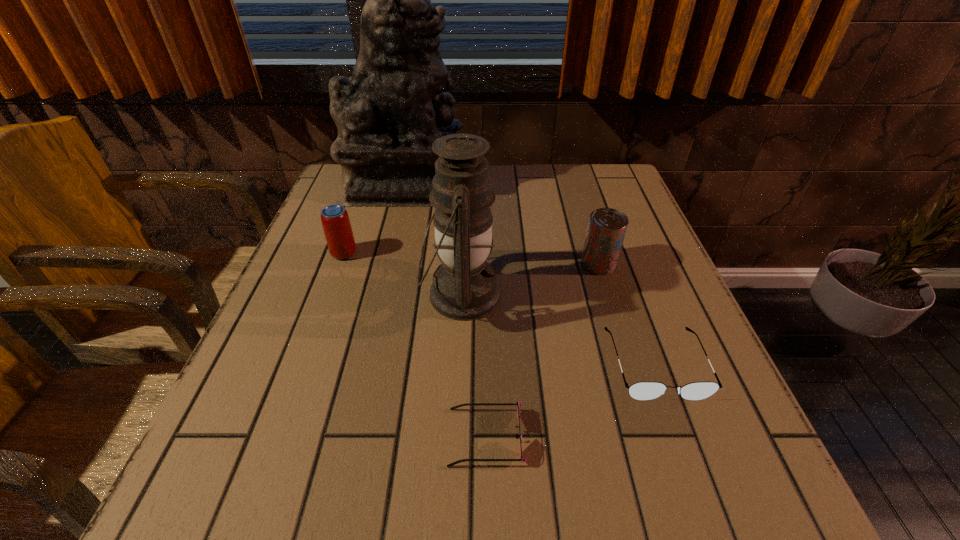
Locate an element on the screen. The width and height of the screenshot is (960, 540). vacant space situated 0.290m on the left of the right beer can is located at coordinates (452, 264).

The height and width of the screenshot is (540, 960). Identify the location of free space located 0.120m on the front of the left beer can. (327, 299).

Find the location of a particular element. vacant position located 0.130m on the lenses of the second shortest object is located at coordinates (697, 481).

This screenshot has height=540, width=960. In order to click on free region located on the bridge of the shortest object in this screenshot , I will do pos(236,437).

Image resolution: width=960 pixels, height=540 pixels. What are the coordinates of `free space located 0.330m on the bridge of the shortest object` in the screenshot? It's located at (236, 437).

This screenshot has width=960, height=540. I want to click on free space located on the bridge of the shortest object, so point(397,437).

Locate an element on the screen. The image size is (960, 540). object that is at the far edge is located at coordinates (395, 106).

This screenshot has height=540, width=960. I want to click on object situated at the near edge, so click(x=518, y=404).

In order to click on sculpture present at the left edge in this screenshot , I will do `click(395, 106)`.

At what (x,y) coordinates should I click in order to perform the action: click on beer can located at the left edge. Please return your answer as a coordinate pair (x, y). Image resolution: width=960 pixels, height=540 pixels. Looking at the image, I should click on (336, 224).